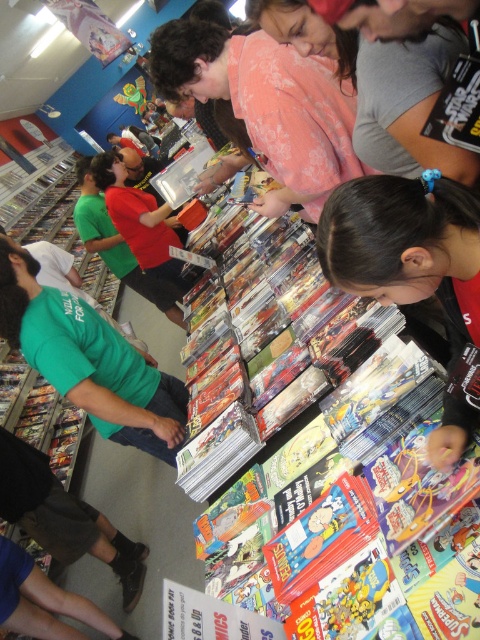
You are a customer in the comic book store and want to pick up the pink cotton shirt at upper center and the plush yellow toy at center. Which item should you reach for first to grab both efficiently?

You should reach for the pink cotton shirt at upper center first since it is closer to you than the plush yellow toy at center, allowing you to grab both items efficiently.